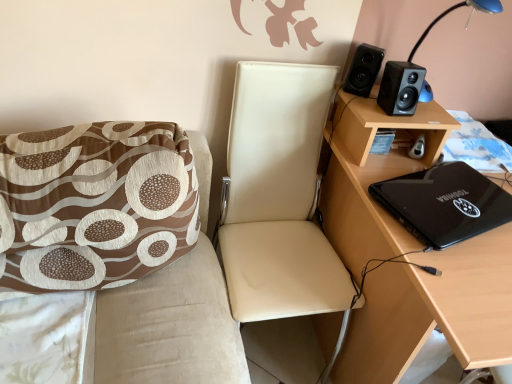
Identify the location of vacant area situated below black plastic table lamp at upper right (from a real-world perspective). The height and width of the screenshot is (384, 512). (429, 112).